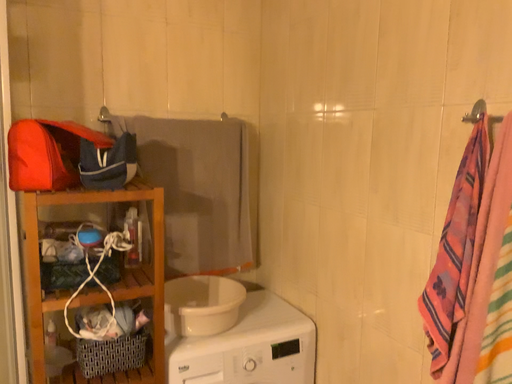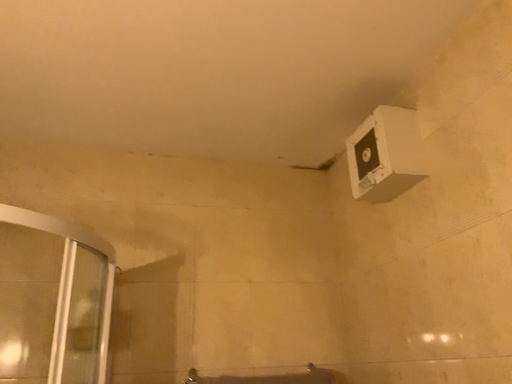
Question: Which way did the camera rotate in the video?

Choices:
 (A) rotated downward
 (B) rotated upward

Answer: (B)